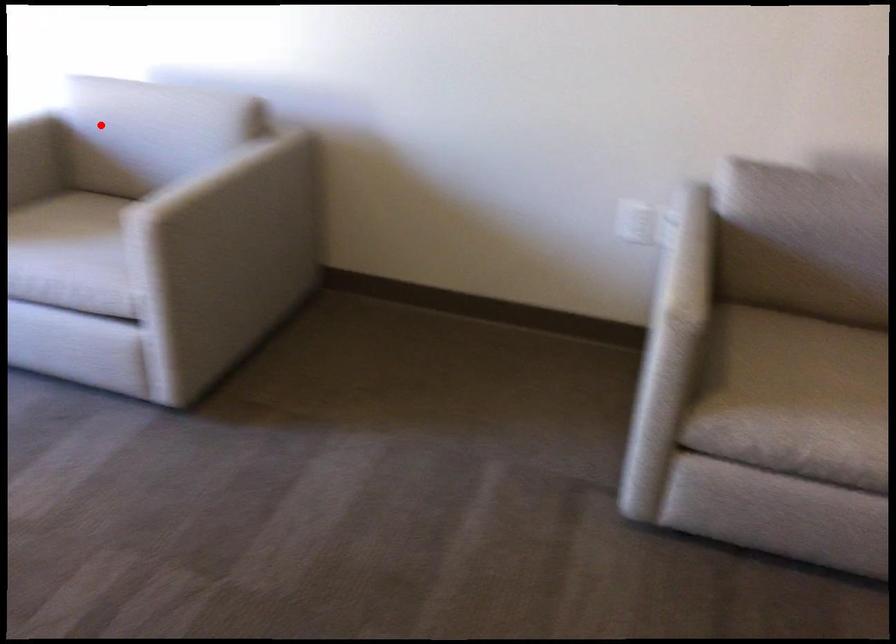
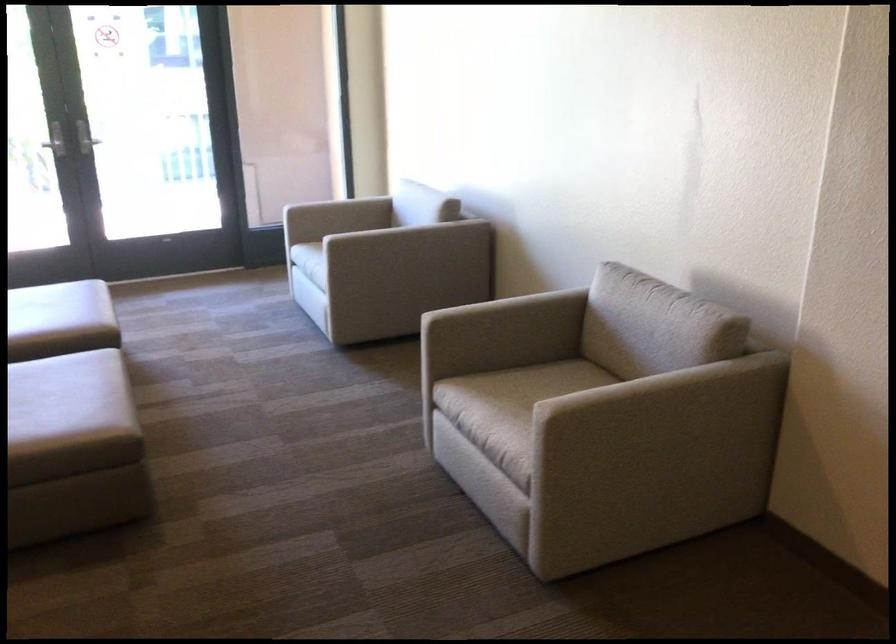
Question: I am providing you with two images of the same scene from different viewpoints. A red point is shown in image1. For the corresponding object point in image2, is it positioned nearer or farther from the camera?

Choices:
 (A) Nearer
 (B) Farther

Answer: (B)